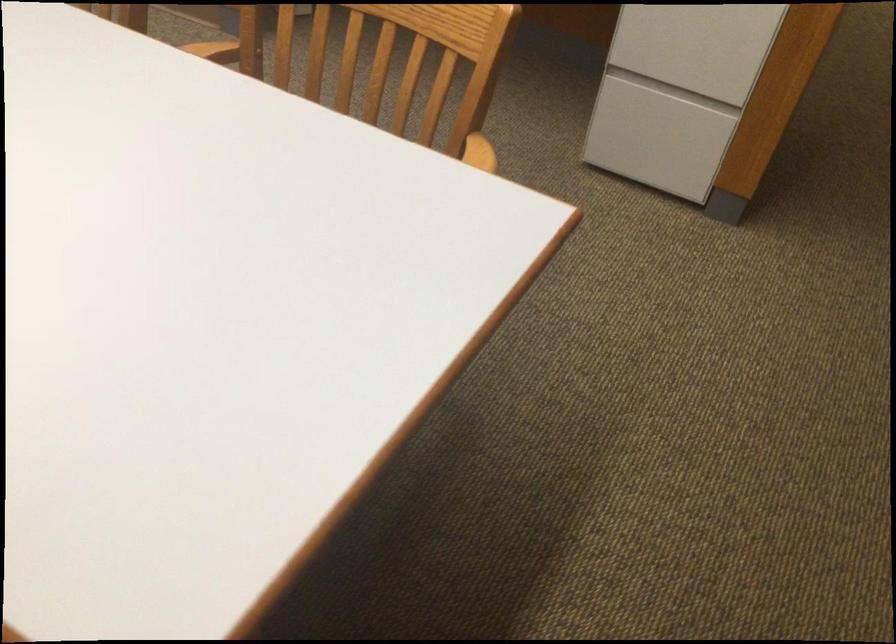
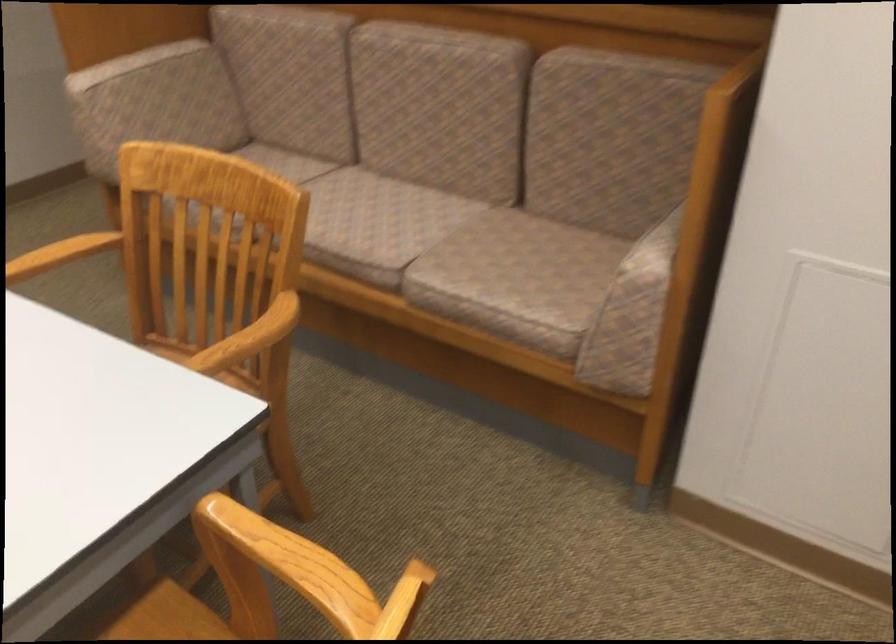
The images are taken continuously from a first-person perspective. In which direction are you moving?

The cameraman walked toward left, forward.